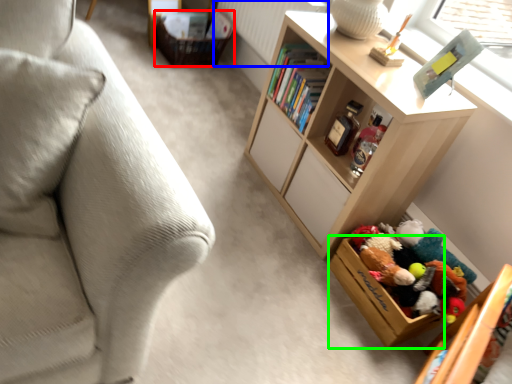
Question: Which object is the farthest from storage box (highlighted by a red box)? Choose among these: radiator (highlighted by a blue box) or storage box (highlighted by a green box).

Choices:
 (A) radiator
 (B) storage box

Answer: (B)